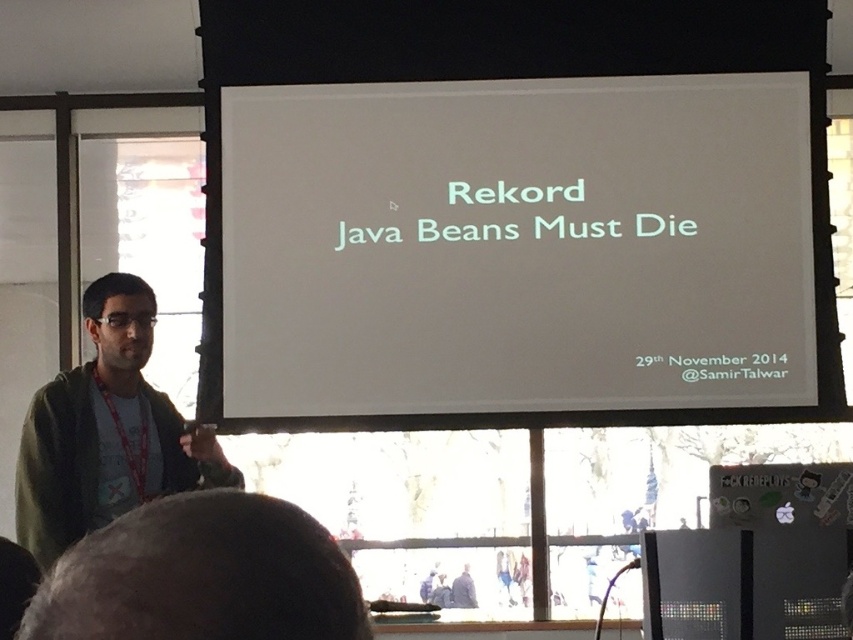
You are a photographer adjusting your camera settings to focus on two points in the presentation scene. The first point is at coordinate point (389, 180) and the second is at point (74, 568). If you focus on the first point, will the second point be in focus?

Point (389, 180) is further to the camera than point (74, 568). Therefore, if you focus on the first point, the second point will also be in focus as it is closer to the camera than the focused point.

You are an attendee at the presentation and you want to take a photo of the slide and the speaker. The white paper at center and the dark green sweater at upper left are in your camera view. Which object should you adjust your camera to focus on to ensure both the slide and the speaker are in focus?

You should focus on the white paper at center because it is above the dark green sweater at upper left, so adjusting focus to the white paper at center will keep both objects in focus as they are vertically aligned.

You are attending a presentation and notice two green items in the scene. The dark green sweater at upper left and the green casual shirt at left. Which one is closer to you from your perspective?

The dark green sweater at upper left is closer to you because it is in front of the green casual shirt at left.